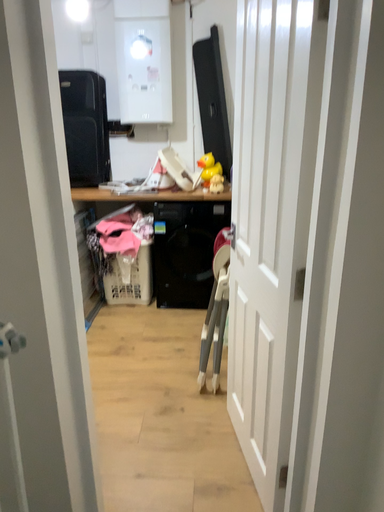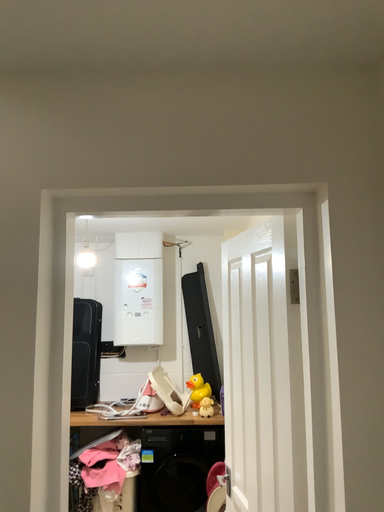
Question: Which way did the camera rotate in the video?

Choices:
 (A) rotated downward
 (B) rotated upward

Answer: (B)